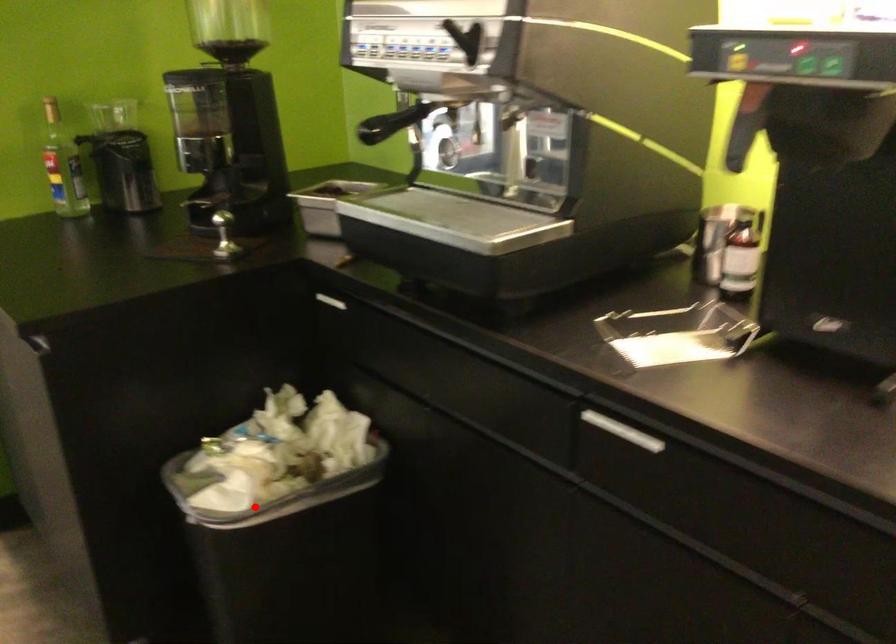
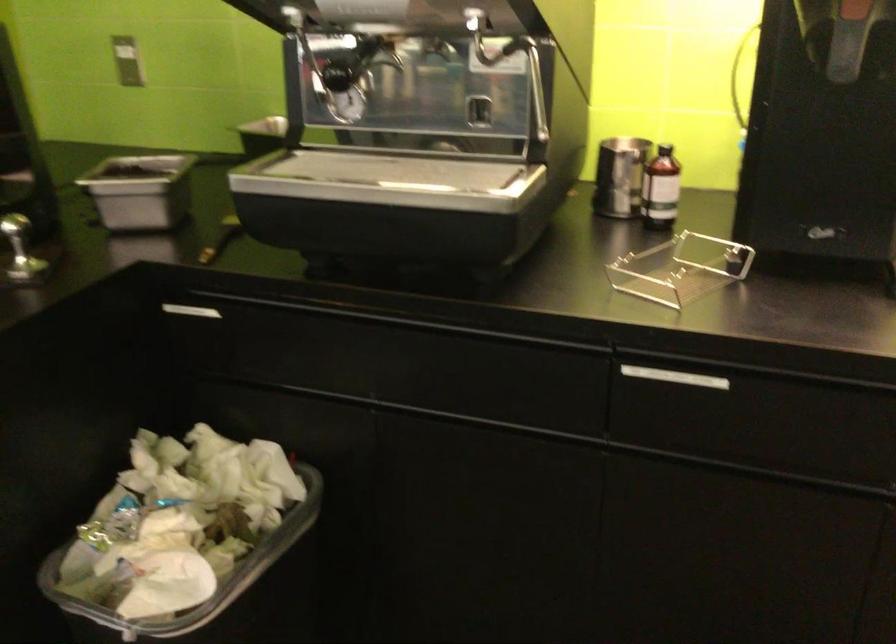
In the second image, find the point that corresponds to the highlighted location in the first image.

(218, 592)